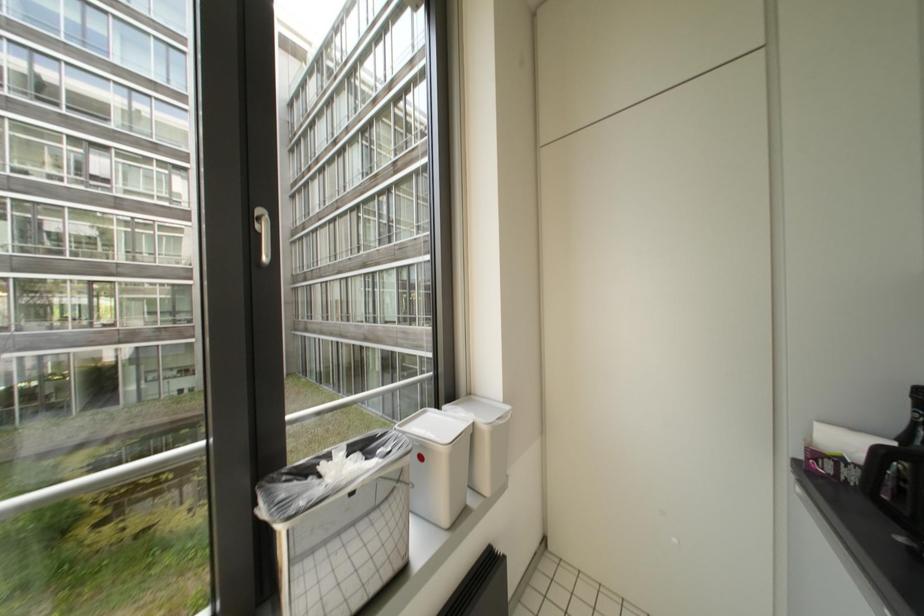
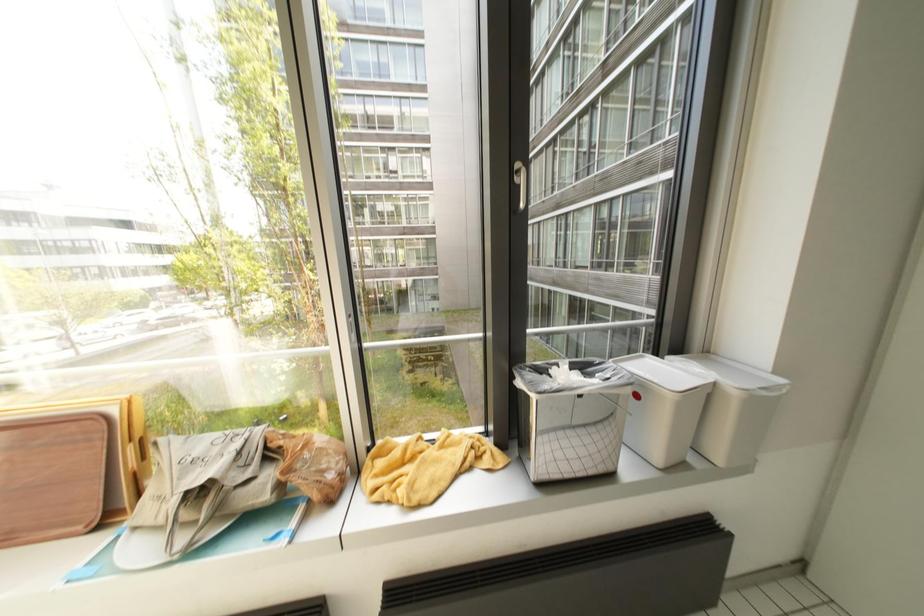
Question: The first image is from the beginning of the video and the second image is from the end. How did the camera likely rotate when shooting the video?

Choices:
 (A) Left
 (B) Right
 (C) Up
 (D) Down

Answer: (A)